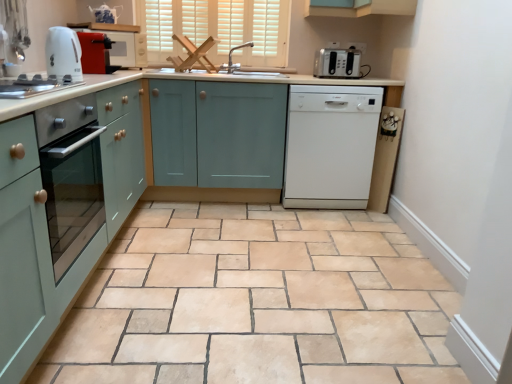
How much space does white glossy electric kettle at upper left, marked as the 2th home appliance in a right-to-left arrangement, occupy vertically?

The height of white glossy electric kettle at upper left, marked as the 2th home appliance in a right-to-left arrangement, is 9.30 inches.

Locate an element on the screen. This screenshot has width=512, height=384. white glossy electric kettle at upper left, the 1th home appliance in the left-to-right sequence is located at coordinates (63, 53).

How much space does matte teal cabinet at left, which is counted as the second cabinetry, starting from the right, occupy vertically?

35.92 inches.

From the picture: What is the approximate height of white glossy electric kettle at left, which appears as the second kitchen appliance when viewed from the right?

white glossy electric kettle at left, which appears as the second kitchen appliance when viewed from the right, is 2.09 inches tall.

This screenshot has width=512, height=384. Describe the element at coordinates (33, 85) in the screenshot. I see `white glossy electric kettle at left, acting as the 3th kitchen appliance starting from the top` at that location.

In order to face silver metallic faucet at center, should I rotate leftwards or rightwards?

A 2.401 degree turn to the left will do.

You are a GUI agent. You are given a task and a screenshot of the screen. Output one action in this format:
    pyautogui.click(x=<x>, y=<y>)
    Task: Click on the white glossy electric kettle at upper left, the 1th home appliance in the left-to-right sequence
    The height and width of the screenshot is (384, 512).
    Given the screenshot: What is the action you would take?
    pyautogui.click(x=63, y=53)

Is matte red toaster at upper left, marked as the second kitchen appliance in a bottom-to-top arrangement, positioned with its back to white glossy electric kettle at upper left, marked as the 2th home appliance in a right-to-left arrangement?

No, matte red toaster at upper left, marked as the second kitchen appliance in a bottom-to-top arrangement, is not facing the opposite direction of white glossy electric kettle at upper left, marked as the 2th home appliance in a right-to-left arrangement.

In the image, is matte red toaster at upper left, which is the second kitchen appliance from back to front, positioned in front of or behind white glossy electric kettle at upper left, the 1th home appliance in the left-to-right sequence?

Visually, matte red toaster at upper left, which is the second kitchen appliance from back to front, is located behind white glossy electric kettle at upper left, the 1th home appliance in the left-to-right sequence.

From the image's perspective, between matte red toaster at upper left, marked as the second kitchen appliance in a bottom-to-top arrangement, and white glossy electric kettle at upper left, which appears as the second home appliance when viewed from the back, who is located below?

From the image's view, white glossy electric kettle at upper left, which appears as the second home appliance when viewed from the back, is below.

Based on the photo, from a real-world perspective, is matte red toaster at upper left, the 3th kitchen appliance in the right-to-left sequence, located higher than white glossy electric kettle at upper left, the 1th home appliance in the left-to-right sequence?

Incorrect, from a real-world perspective, matte red toaster at upper left, the 3th kitchen appliance in the right-to-left sequence, is lower than white glossy electric kettle at upper left, the 1th home appliance in the left-to-right sequence.

Consider the image. Can you tell me how much white glossy electric kettle at left, placed as the first kitchen appliance when sorted from front to back, and white glossy dishwasher at center, which is the 2th home appliance in front-to-back order, differ in facing direction?

89.9 degrees.

From a real-world perspective, is white glossy electric kettle at left, marked as the 3th kitchen appliance in a back-to-front arrangement, above or below white glossy dishwasher at center, acting as the 2th home appliance starting from the left?

white glossy electric kettle at left, marked as the 3th kitchen appliance in a back-to-front arrangement, is above white glossy dishwasher at center, acting as the 2th home appliance starting from the left.

Which is behind, point (6, 88) or point (301, 113)?

Point (301, 113)

Can you confirm if white glossy electric kettle at left, positioned as the 2th kitchen appliance in left-to-right order, is positioned to the left of white glossy dishwasher at center, which is the 1th home appliance in right-to-left order?

Yes, white glossy electric kettle at left, positioned as the 2th kitchen appliance in left-to-right order, is to the left of white glossy dishwasher at center, which is the 1th home appliance in right-to-left order.

Considering the relative positions of matte teal cabinet at left, which is counted as the second cabinetry, starting from the right, and matte red toaster at upper left, the 3th kitchen appliance in the right-to-left sequence, in the image provided, is matte teal cabinet at left, which is counted as the second cabinetry, starting from the right, to the right of matte red toaster at upper left, the 3th kitchen appliance in the right-to-left sequence, from the viewer's perspective?

No, matte teal cabinet at left, which is counted as the second cabinetry, starting from the right, is not to the right of matte red toaster at upper left, the 3th kitchen appliance in the right-to-left sequence.

Could you tell me if matte teal cabinet at left, acting as the 1th cabinetry starting from the left, is facing matte red toaster at upper left, the 3th kitchen appliance in the right-to-left sequence?

No, matte teal cabinet at left, acting as the 1th cabinetry starting from the left, is not facing towards matte red toaster at upper left, the 3th kitchen appliance in the right-to-left sequence.

This screenshot has height=384, width=512. Identify the location of the 2nd cabinetry located beneath the matte red toaster at upper left, which is the first kitchen appliance from left to right (from a real-world perspective). (61, 208).

From the image's perspective, is matte teal cabinet at left, acting as the 1th cabinetry starting from the left, above or below matte red toaster at upper left, the 3th kitchen appliance in the right-to-left sequence?

Based on their image positions, matte teal cabinet at left, acting as the 1th cabinetry starting from the left, is located beneath matte red toaster at upper left, the 3th kitchen appliance in the right-to-left sequence.

Is point (99, 65) positioned in front of point (231, 49)?

Yes.

Considering the positions of objects matte red toaster at upper left, marked as the second kitchen appliance in a bottom-to-top arrangement, and silver metallic faucet at center in the image provided, who is behind, matte red toaster at upper left, marked as the second kitchen appliance in a bottom-to-top arrangement, or silver metallic faucet at center?

silver metallic faucet at center is further from the camera.

From the picture: Is matte red toaster at upper left, which is counted as the 2th kitchen appliance, starting from the front, completely or partially outside of silver metallic faucet at center?

Yes.

Considering the relative sizes of matte red toaster at upper left, which is the first kitchen appliance from left to right, and silver metallic faucet at center in the image provided, is matte red toaster at upper left, which is the first kitchen appliance from left to right, smaller than silver metallic faucet at center?

Indeed, matte red toaster at upper left, which is the first kitchen appliance from left to right, has a smaller size compared to silver metallic faucet at center.

Is white matte window at upper center thinner than matte red toaster at upper left, which is the 2th kitchen appliance from top to bottom?

Correct, the width of white matte window at upper center is less than that of matte red toaster at upper left, which is the 2th kitchen appliance from top to bottom.

Considering the relative sizes of white matte window at upper center and matte red toaster at upper left, marked as the second kitchen appliance in a bottom-to-top arrangement, in the image provided, is white matte window at upper center bigger than matte red toaster at upper left, marked as the second kitchen appliance in a bottom-to-top arrangement,?

Correct, white matte window at upper center is larger in size than matte red toaster at upper left, marked as the second kitchen appliance in a bottom-to-top arrangement.

Is the depth of white matte window at upper center less than that of matte red toaster at upper left, marked as the second kitchen appliance in a bottom-to-top arrangement?

No, white matte window at upper center is behind matte red toaster at upper left, marked as the second kitchen appliance in a bottom-to-top arrangement.

Considering the sizes of objects white matte window at upper center and matte red toaster at upper left, the 3th kitchen appliance in the right-to-left sequence, in the image provided, who is taller, white matte window at upper center or matte red toaster at upper left, the 3th kitchen appliance in the right-to-left sequence,?

white matte window at upper center.

Is satin silver toaster at upper right, which is counted as the 1th kitchen appliance, starting from the back, positioned beyond the bounds of white glossy electric kettle at left, marked as the 3th kitchen appliance in a back-to-front arrangement?

Absolutely, satin silver toaster at upper right, which is counted as the 1th kitchen appliance, starting from the back, is external to white glossy electric kettle at left, marked as the 3th kitchen appliance in a back-to-front arrangement.

Can you confirm if satin silver toaster at upper right, which is counted as the 1th kitchen appliance, starting from the back, is wider than white glossy electric kettle at left, acting as the 3th kitchen appliance starting from the top?

Indeed, satin silver toaster at upper right, which is counted as the 1th kitchen appliance, starting from the back, has a greater width compared to white glossy electric kettle at left, acting as the 3th kitchen appliance starting from the top.

Considering the relative sizes of satin silver toaster at upper right, which is counted as the 1th kitchen appliance, starting from the back, and white glossy electric kettle at left, acting as the 3th kitchen appliance starting from the top, in the image provided, is satin silver toaster at upper right, which is counted as the 1th kitchen appliance, starting from the back, shorter than white glossy electric kettle at left, acting as the 3th kitchen appliance starting from the top,?

No, satin silver toaster at upper right, which is counted as the 1th kitchen appliance, starting from the back, is not shorter than white glossy electric kettle at left, acting as the 3th kitchen appliance starting from the top.

Is satin silver toaster at upper right, the 3th kitchen appliance from the bottom, facing towards white glossy electric kettle at left, placed as the first kitchen appliance when sorted from front to back?

No.

Is matte glass oven at left next to silver metallic faucet at center?

matte glass oven at left is not next to silver metallic faucet at center, and they're not touching.

Based on the photo, which point is more forward, [73,152] or [231,72]?

The point [73,152] is closer to the camera.

Considering the relative sizes of matte glass oven at left and silver metallic faucet at center in the image provided, is matte glass oven at left wider than silver metallic faucet at center?

Correct, the width of matte glass oven at left exceeds that of silver metallic faucet at center.

Considering their positions, is matte glass oven at left located in front of or behind silver metallic faucet at center?

In the image, matte glass oven at left appears in front of silver metallic faucet at center.

Where is `the 1st kitchen appliance behind the white glossy electric kettle at upper left, which appears as the first home appliance when viewed from the front`? This screenshot has height=384, width=512. the 1st kitchen appliance behind the white glossy electric kettle at upper left, which appears as the first home appliance when viewed from the front is located at coordinates (96, 53).

Where is `home appliance on the right of white glossy electric kettle at left, which appears as the second kitchen appliance when viewed from the right`? The height and width of the screenshot is (384, 512). home appliance on the right of white glossy electric kettle at left, which appears as the second kitchen appliance when viewed from the right is located at coordinates (330, 146).

Estimate the real-world distances between objects in this image. Which object is further from matte glass oven at left, white glossy electric kettle at left, positioned as the 1th kitchen appliance in bottom-to-top order, or satin silver toaster at upper right, the 1th kitchen appliance viewed from the right?

satin silver toaster at upper right, the 1th kitchen appliance viewed from the right, lies further to matte glass oven at left than the other object.

Which object lies further to the anchor point white glossy electric kettle at left, marked as the 3th kitchen appliance in a back-to-front arrangement, teal matte cabinet at center, acting as the 2th cabinetry starting from the left, or natural stone floor at center?

natural stone floor at center is further to white glossy electric kettle at left, marked as the 3th kitchen appliance in a back-to-front arrangement.

From the image, which object appears to be farther from matte red toaster at upper left, which is counted as the 2th kitchen appliance, starting from the front, satin silver toaster at upper right, the 3th kitchen appliance from the bottom, or white glossy electric kettle at upper left, the 1th home appliance in the left-to-right sequence?

satin silver toaster at upper right, the 3th kitchen appliance from the bottom.

Looking at the image, which one is located closer to satin silver toaster at upper right, which is counted as the 1th kitchen appliance, starting from the back, white glossy electric kettle at upper left, which appears as the second home appliance when viewed from the back, or white glossy dishwasher at center, the first home appliance from the back?

white glossy dishwasher at center, the first home appliance from the back, is closer to satin silver toaster at upper right, which is counted as the 1th kitchen appliance, starting from the back.

Looking at the image, which one is located closer to white glossy electric kettle at left, positioned as the 2th kitchen appliance in left-to-right order, silver metallic faucet at center or matte red toaster at upper left, which is the first kitchen appliance from left to right?

matte red toaster at upper left, which is the first kitchen appliance from left to right, is closer to white glossy electric kettle at left, positioned as the 2th kitchen appliance in left-to-right order.

From the image, which object appears to be farther from white glossy dishwasher at center, which is the 1th home appliance in right-to-left order, teal matte cabinet at center, which is the 1th cabinetry in right-to-left order, or white glossy electric kettle at upper left, which appears as the second home appliance when viewed from the back?

Based on the image, white glossy electric kettle at upper left, which appears as the second home appliance when viewed from the back, appears to be further to white glossy dishwasher at center, which is the 1th home appliance in right-to-left order.

Looking at the image, which one is located closer to matte teal cabinet at left, acting as the 1th cabinetry starting from the left, white matte window at upper center or natural stone floor at center?

natural stone floor at center lies closer to matte teal cabinet at left, acting as the 1th cabinetry starting from the left, than the other object.

When comparing their distances from white glossy dishwasher at center, acting as the 2th home appliance starting from the left, does satin silver toaster at upper right, placed as the 3th kitchen appliance when sorted from left to right, or silver metallic faucet at center seem further?

The object further to white glossy dishwasher at center, acting as the 2th home appliance starting from the left, is silver metallic faucet at center.

Find the location of a particular element. The width and height of the screenshot is (512, 384). cabinetry between white glossy countertop at center and matte red toaster at upper left, the 3th kitchen appliance in the right-to-left sequence, from front to back is located at coordinates (61, 208).

This screenshot has width=512, height=384. Identify the location of oven between matte teal cabinet at left, acting as the 1th cabinetry starting from the left, and silver metallic faucet at center in the front-back direction. (73, 193).

The image size is (512, 384). Find the location of `ceramic tile located between matte glass oven at left and white glossy dishwasher at center, which is the 1th home appliance in right-to-left order, in the depth direction`. ceramic tile located between matte glass oven at left and white glossy dishwasher at center, which is the 1th home appliance in right-to-left order, in the depth direction is located at coordinates (257, 302).

Image resolution: width=512 pixels, height=384 pixels. In order to click on ceramic tile positioned between matte glass oven at left and silver metallic faucet at center from near to far in this screenshot , I will do `click(257, 302)`.